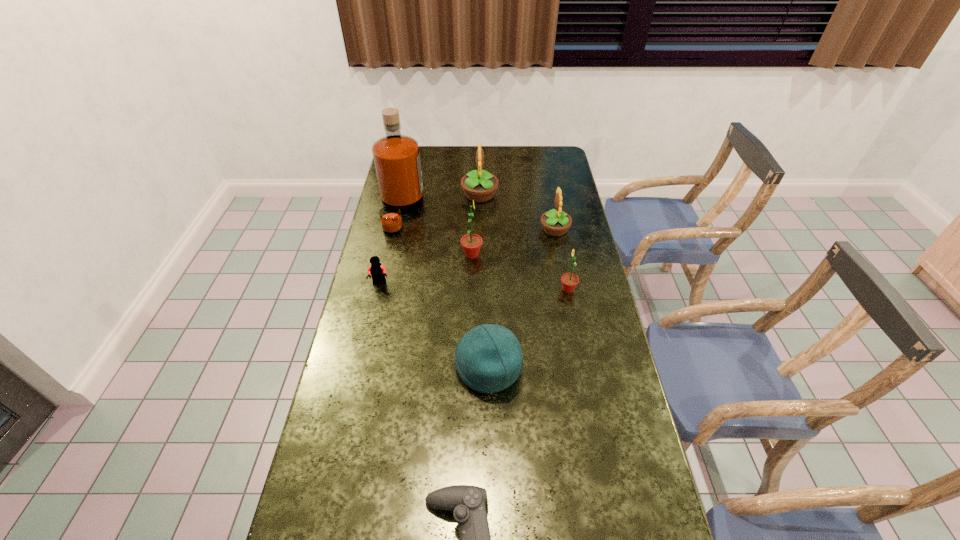
Locate an element on the screen. The image size is (960, 540). free space between the second farthest sunflower and the left green sunflower is located at coordinates (514, 242).

Locate an element on the screen. Image resolution: width=960 pixels, height=540 pixels. free space between the farthest sunflower and the smaller yellow sunflower is located at coordinates (517, 212).

This screenshot has width=960, height=540. Find the location of `empty space that is in between the beanie and the third nearest sunflower`. empty space that is in between the beanie and the third nearest sunflower is located at coordinates (522, 299).

Find the location of a particular element. This screenshot has height=540, width=960. vacant point located between the sixth tallest object and the farther green sunflower is located at coordinates (480, 311).

Locate an element on the screen. The width and height of the screenshot is (960, 540). object that is the fourth closest to the second farthest sunflower is located at coordinates (396, 157).

You are a GUI agent. You are given a task and a screenshot of the screen. Output one action in this format:
    pyautogui.click(x=<x>, y=<y>)
    Task: Click on the seventh closest object relative to the nearer yellow sunflower
    The image size is (960, 540).
    Given the screenshot: What is the action you would take?
    pyautogui.click(x=468, y=502)

Where is `sunflower identified as the closest to the farthest sunflower`? This screenshot has width=960, height=540. sunflower identified as the closest to the farthest sunflower is located at coordinates (555, 223).

At what (x,y) coordinates should I click in order to perform the action: click on sunflower identified as the fourth closest to the nearest object. Please return your answer as a coordinate pair (x, y). This screenshot has width=960, height=540. Looking at the image, I should click on (479, 185).

Find the location of `free point that satisfies the following two spatial constraints: 1. on the front label of the seventh farthest object; 2. on the left side of the tallest object`. free point that satisfies the following two spatial constraints: 1. on the front label of the seventh farthest object; 2. on the left side of the tallest object is located at coordinates (369, 368).

This screenshot has width=960, height=540. What are the coordinates of `free space that satisfies the following two spatial constraints: 1. on the face of the farther yellow sunflower; 2. on the front-facing side of the second shortest object` in the screenshot? It's located at (480, 283).